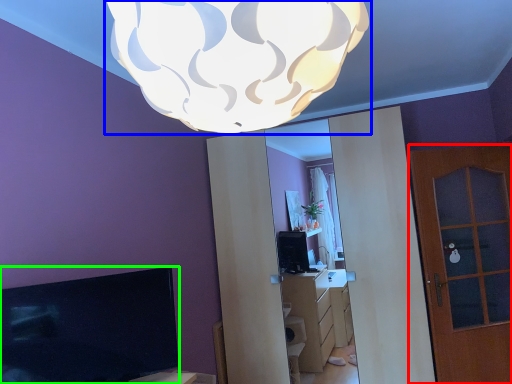
Question: Which is nearer to the door (highlighted by a red box)? lamp (highlighted by a blue box) or television (highlighted by a green box).

Choices:
 (A) lamp
 (B) television

Answer: (B)